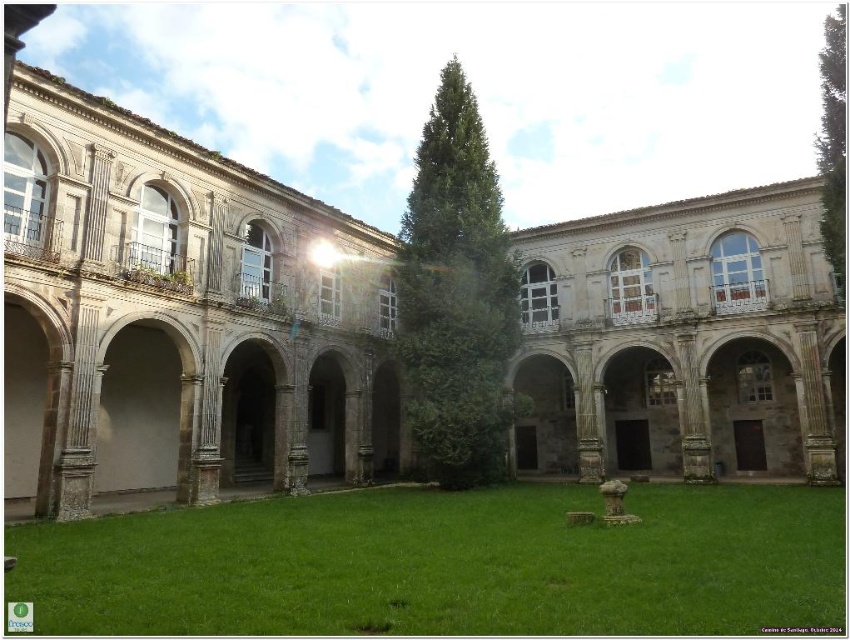
Question: Among these points, which one is nearest to the camera?

Choices:
 (A) (830, 220)
 (B) (452, 291)

Answer: (A)

Question: Is green grass at center smaller than green leafy tree at right?

Choices:
 (A) yes
 (B) no

Answer: (A)

Question: Considering the relative positions of green leafy tree at center and green leafy tree at right in the image provided, where is green leafy tree at center located with respect to green leafy tree at right?

Choices:
 (A) left
 (B) right

Answer: (A)

Question: Among these points, which one is farthest from the camera?

Choices:
 (A) (842, 26)
 (B) (488, 528)

Answer: (A)

Question: Which of the following is the closest to the observer?

Choices:
 (A) green leafy tree at center
 (B) green leafy tree at right
 (C) green grass at center

Answer: (C)

Question: Does green grass at center lie behind green leafy tree at center?

Choices:
 (A) no
 (B) yes

Answer: (A)